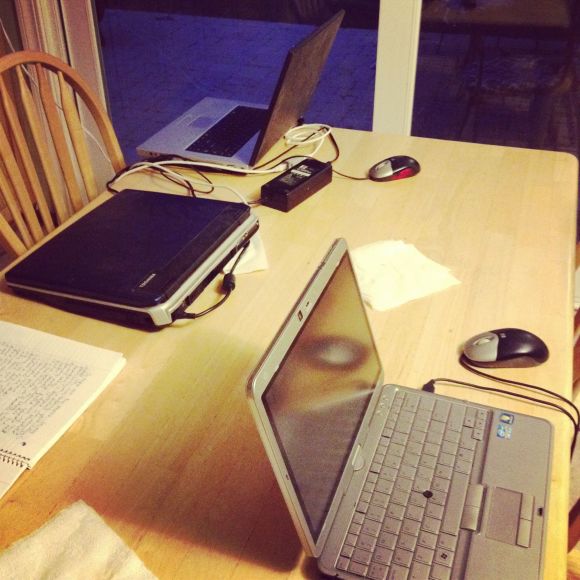
Locate an element on the screen. Image resolution: width=580 pixels, height=580 pixels. table is located at coordinates (117, 401).